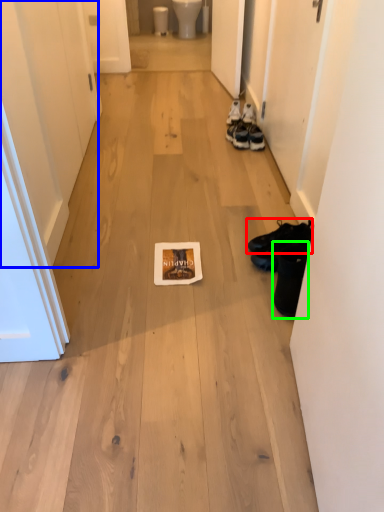
Question: Which is nearer to the footwear (highlighted by a red box)? door (highlighted by a blue box) or footwear (highlighted by a green box).

Choices:
 (A) door
 (B) footwear

Answer: (B)